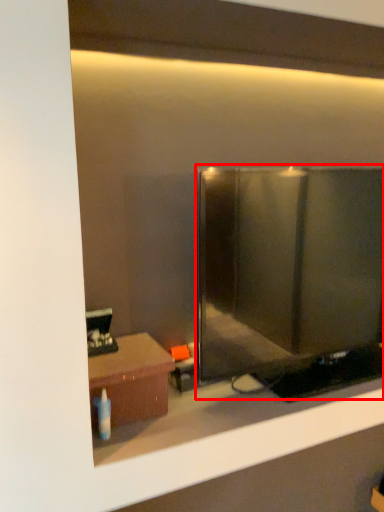
Question: From the image's perspective, where is glass door (annotated by the red box) located in relation to table in the image?

Choices:
 (A) below
 (B) above

Answer: (B)